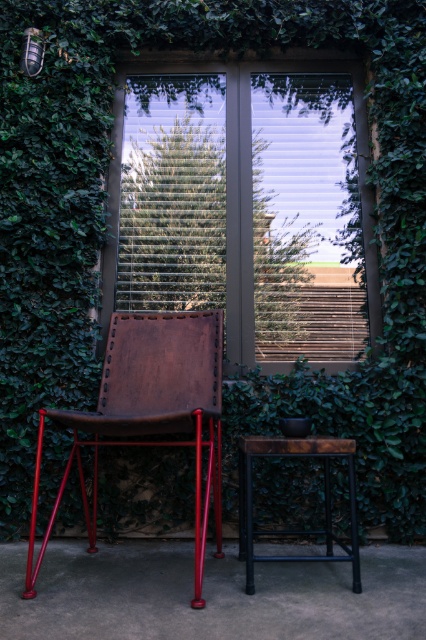
In the scene shown: Can you confirm if matte glass window at center is taller than rustic wood table at center?

Indeed, matte glass window at center has a greater height compared to rustic wood table at center.

Can you confirm if matte glass window at center is bigger than rustic wood table at center?

Yes.

Identify the location of matte glass window at center. This screenshot has width=426, height=640. (244, 204).

Can you confirm if matte glass window at center is smaller than leather at left?

Yes, matte glass window at center is smaller than leather at left.

Does matte glass window at center have a lesser height compared to leather at left?

In fact, matte glass window at center may be taller than leather at left.

Identify the location of matte glass window at center. Image resolution: width=426 pixels, height=640 pixels. (244, 204).

The image size is (426, 640). Find the location of `matte glass window at center`. matte glass window at center is located at coordinates (244, 204).

Does leather at left come in front of rustic wood table at center?

Yes, leather at left is closer to the viewer.

Can you confirm if leather at left is shorter than rustic wood table at center?

No.

Which is in front, point (204, 340) or point (264, 557)?

Point (264, 557) is in front.

Where is `leather at left`? The image size is (426, 640). leather at left is located at coordinates (149, 412).